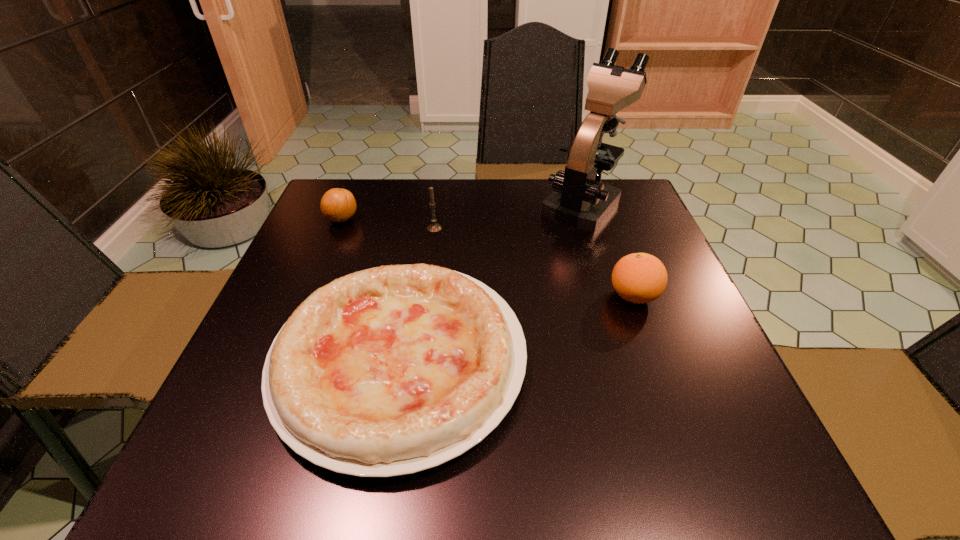
The height and width of the screenshot is (540, 960). In order to click on the tallest object in this screenshot , I will do `click(580, 200)`.

Find the location of a particular element. This screenshot has width=960, height=540. candle is located at coordinates (433, 227).

At what (x,y) coordinates should I click in order to perform the action: click on the third tallest object. Please return your answer as a coordinate pair (x, y). The height and width of the screenshot is (540, 960). Looking at the image, I should click on (639, 278).

Where is `the right orange`? The height and width of the screenshot is (540, 960). the right orange is located at coordinates tap(639, 278).

Find the location of a particular element. the shorter orange is located at coordinates (338, 205).

The width and height of the screenshot is (960, 540). In order to click on the farther orange in this screenshot , I will do `click(338, 205)`.

I want to click on pizza, so click(392, 370).

Locate an element on the screen. The width and height of the screenshot is (960, 540). vacant space situated 0.400m on the front of the microscope is located at coordinates (632, 362).

Identify the location of free spot located 0.300m on the front of the candle. (422, 322).

The width and height of the screenshot is (960, 540). I want to click on vacant region located 0.310m on the left of the taller orange, so click(462, 296).